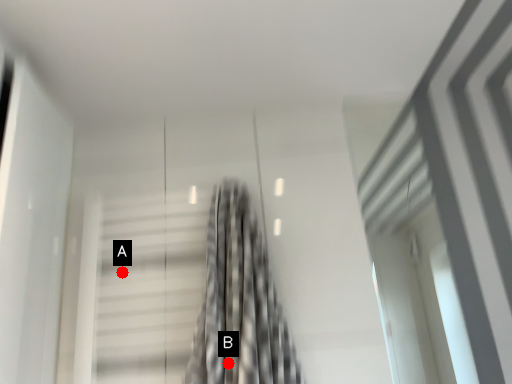
Question: Two points are circled on the image, labeled by A and B beside each circle. Among these points, which one is nearest to the camera?

Choices:
 (A) A is closer
 (B) B is closer

Answer: (B)